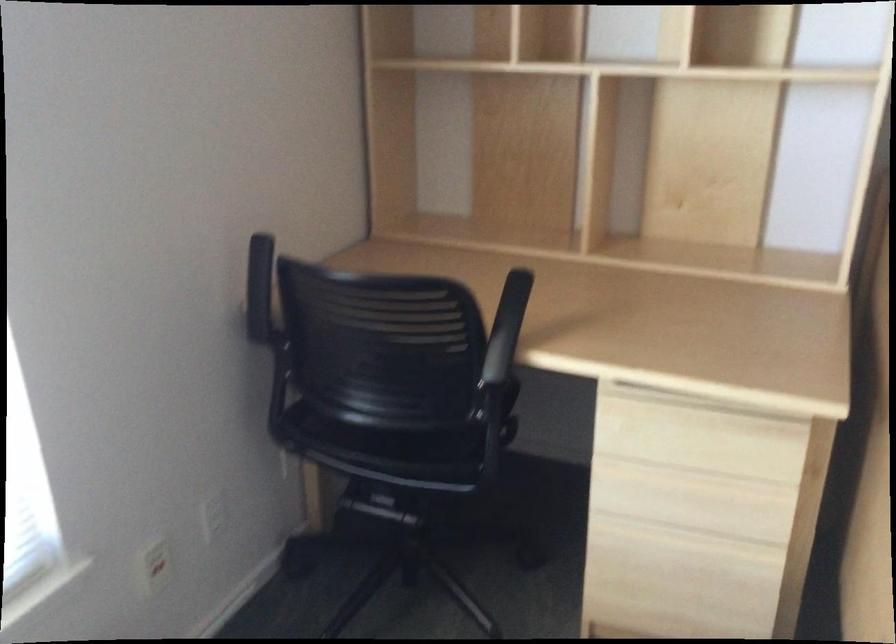
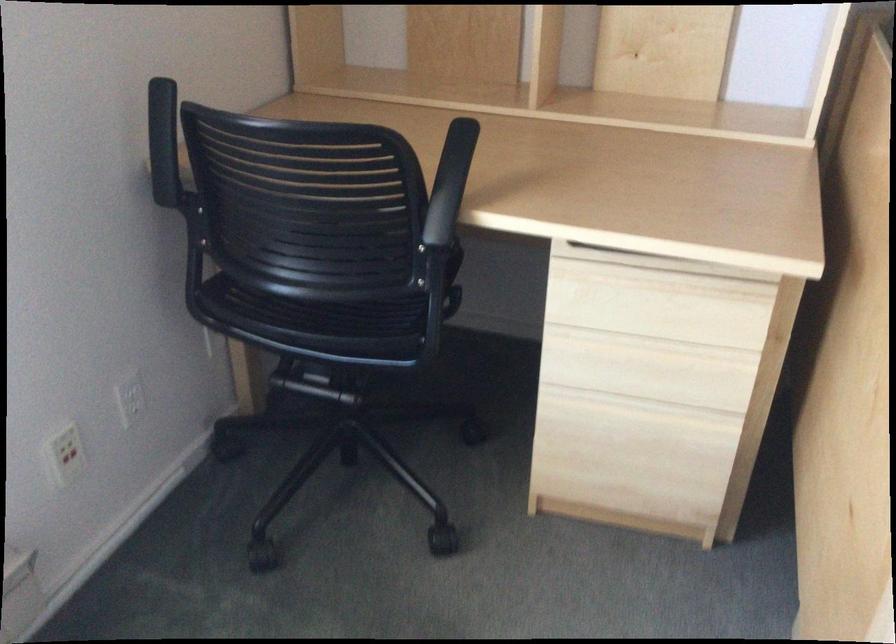
Where in the second image is the point corresponding to (506,326) from the first image?

(450, 183)